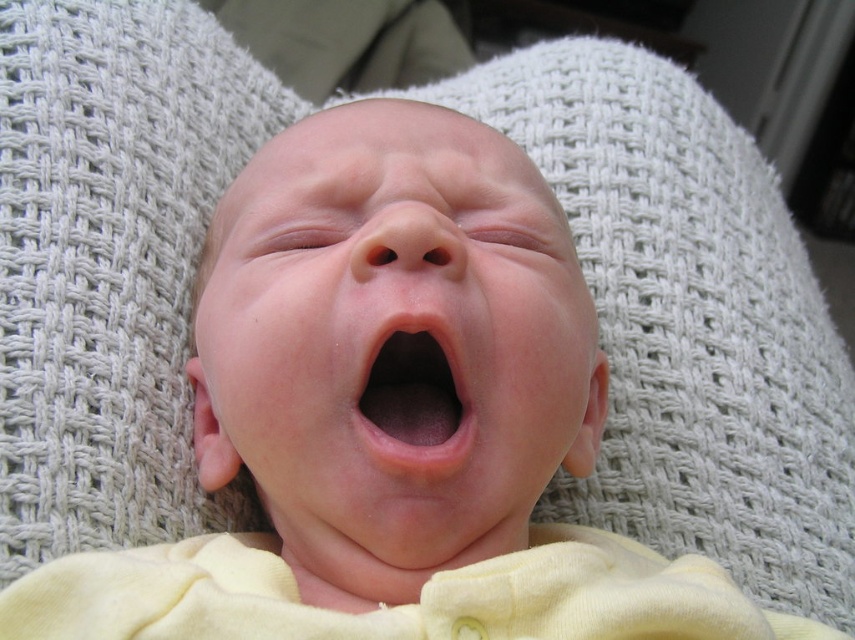
Consider the image. You are a photographer adjusting your camera focus. You need to focus on both point (x=376, y=272) and point (x=446, y=403). Which point should you focus on first to ensure the closest object is sharp?

You should focus on point (x=376, y=272) first because it is closer to the camera than point (x=446, y=403).

You are a pediatrician examining a baby. You notice the smooth skin face at center and the pink smooth flesh at center. How far apart are these two areas on the baby?

The smooth skin face at center and the pink smooth flesh at center are 3.68 inches apart from each other.

Consider the image. Based on the scene description, where is the smooth skin face at center located in terms of coordinates?

The smooth skin face at center is located at the coordinates point (x=393, y=340).